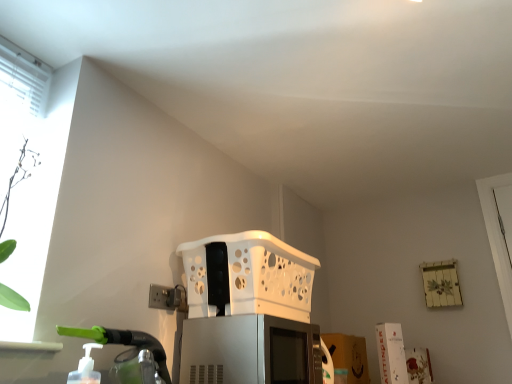
Question: From the image's perspective, is satin silver microwave at center on white plastic electric outlet at lower left?

Choices:
 (A) no
 (B) yes

Answer: (A)

Question: Does satin silver microwave at center have a greater height compared to white plastic electric outlet at lower left?

Choices:
 (A) yes
 (B) no

Answer: (A)

Question: Is satin silver microwave at center further to the viewer compared to white plastic electric outlet at lower left?

Choices:
 (A) yes
 (B) no

Answer: (B)

Question: Would you say satin silver microwave at center is outside white plastic electric outlet at lower left?

Choices:
 (A) no
 (B) yes

Answer: (B)

Question: From the image's perspective, is satin silver microwave at center beneath white plastic electric outlet at lower left?

Choices:
 (A) yes
 (B) no

Answer: (A)

Question: Is the depth of satin silver microwave at center less than that of white plastic electric outlet at lower left?

Choices:
 (A) no
 (B) yes

Answer: (B)

Question: Is white plastic basket at center aimed at satin silver microwave at center?

Choices:
 (A) yes
 (B) no

Answer: (B)

Question: From a real-world perspective, is white plastic basket at center beneath satin silver microwave at center?

Choices:
 (A) yes
 (B) no

Answer: (B)

Question: Is white plastic basket at center facing away from satin silver microwave at center?

Choices:
 (A) yes
 (B) no

Answer: (B)

Question: Is white plastic basket at center smaller than satin silver microwave at center?

Choices:
 (A) no
 (B) yes

Answer: (A)

Question: Is white plastic basket at center outside satin silver microwave at center?

Choices:
 (A) no
 (B) yes

Answer: (B)

Question: Is white plastic basket at center thinner than satin silver microwave at center?

Choices:
 (A) no
 (B) yes

Answer: (A)

Question: Does white plastic basket at center have a greater width compared to white plastic electric outlet at lower left?

Choices:
 (A) no
 (B) yes

Answer: (B)